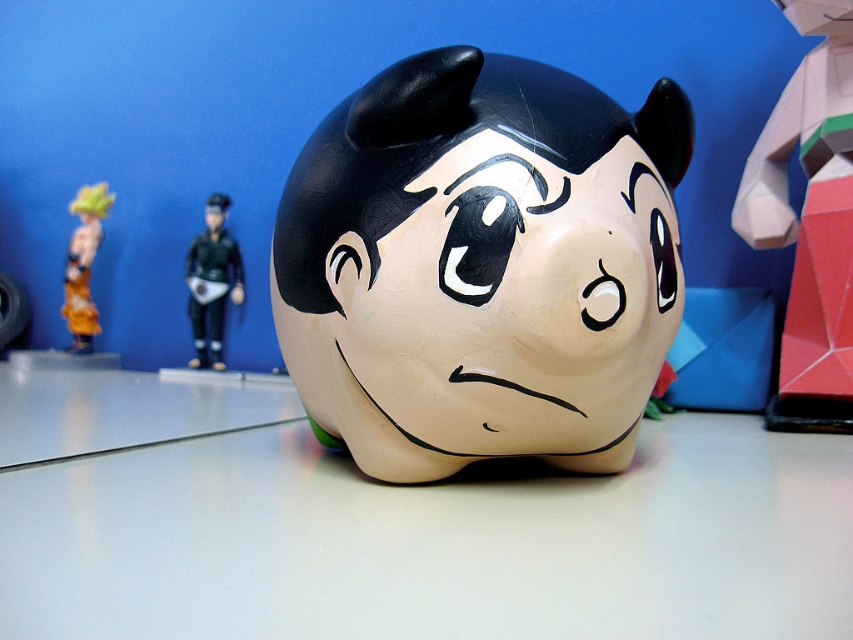
Does geometric paper model at right appear under orange fabric toy at left?

No, geometric paper model at right is not below orange fabric toy at left.

I want to click on geometric paper model at right, so click(809, 220).

Is matte black face at center closer to the viewer compared to orange fabric toy at left?

Yes, it is.

Does matte black face at center appear on the left side of orange fabric toy at left?

No, matte black face at center is not to the left of orange fabric toy at left.

Does point (480, 275) come in front of point (79, 300)?

Yes, it is.

You are a GUI agent. You are given a task and a screenshot of the screen. Output one action in this format:
    pyautogui.click(x=<x>, y=<y>)
    Task: Click on the matte black face at center
    Image resolution: width=853 pixels, height=640 pixels.
    Given the screenshot: What is the action you would take?
    pyautogui.click(x=515, y=301)

Which is behind, point (207, 362) or point (96, 330)?

The point (96, 330) is behind.

Is black matte figure at left bigger than orange fabric toy at left?

Yes, black matte figure at left is bigger than orange fabric toy at left.

You are a GUI agent. You are given a task and a screenshot of the screen. Output one action in this format:
    pyautogui.click(x=<x>, y=<y>)
    Task: Click on the black matte figure at left
    This screenshot has height=640, width=853.
    Given the screenshot: What is the action you would take?
    pyautogui.click(x=212, y=282)

You are a GUI agent. You are given a task and a screenshot of the screen. Output one action in this format:
    pyautogui.click(x=<x>, y=<y>)
    Task: Click on the black matte figure at left
    
    Given the screenshot: What is the action you would take?
    pyautogui.click(x=212, y=282)